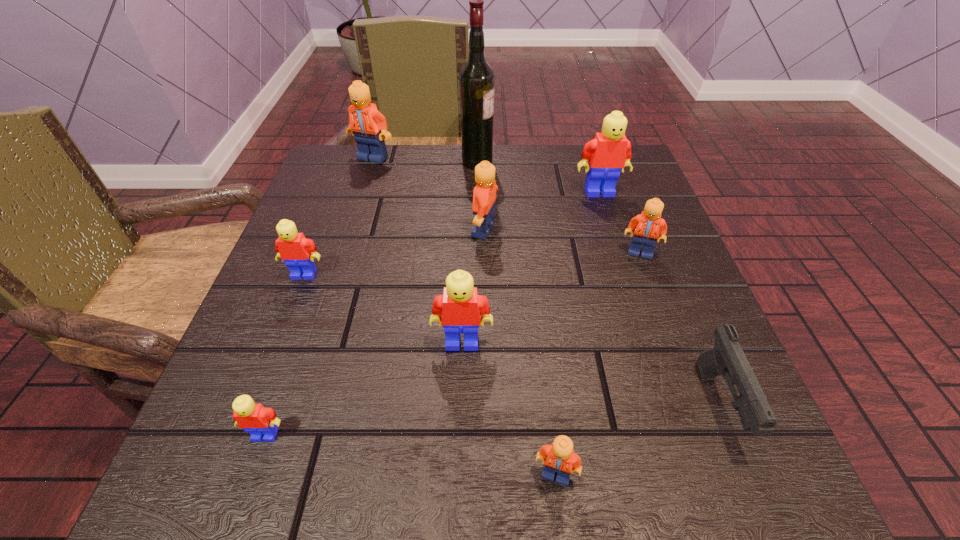
At what (x,y) coordinates should I click in order to perform the action: click on vacant space located on the front-facing side of the third smallest orange Lego. Please return your answer as a coordinate pair (x, y). Looking at the image, I should click on (411, 230).

Identify the location of free space located 0.180m on the front-facing side of the third smallest orange Lego. (380, 230).

The image size is (960, 540). What are the coordinates of `free region located on the front-facing side of the third smallest yellow Lego` in the screenshot? It's located at (457, 490).

Identify the location of vacant space located on the front-facing side of the second smallest orange Lego. (683, 368).

Locate an element on the screen. vacant space located 0.140m on the front-facing side of the second farthest yellow Lego is located at coordinates (276, 346).

This screenshot has height=540, width=960. Identify the location of vacant space located 0.050m at the barrel of the pistol. (757, 500).

What are the coordinates of `vacant space located 0.050m on the front-facing side of the smallest yellow Lego` in the screenshot? It's located at (249, 482).

I want to click on wine bottle present at the far edge, so [476, 79].

This screenshot has height=540, width=960. In order to click on pistol at the near edge in this screenshot , I will do `click(727, 358)`.

This screenshot has width=960, height=540. What are the coordinates of `pistol that is at the right edge` in the screenshot? It's located at (727, 358).